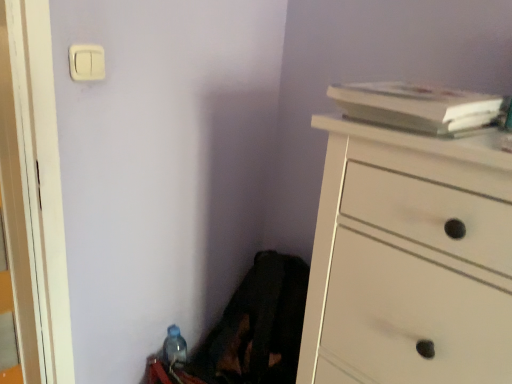
Question: From a real-world perspective, is translucent plastic bottle at lower left physically located above or below white plastic light switch at upper left?

Choices:
 (A) above
 (B) below

Answer: (B)

Question: Based on their positions, is translucent plastic bottle at lower left located to the left or right of white plastic light switch at upper left?

Choices:
 (A) left
 (B) right

Answer: (B)

Question: Which object is positioned farthest from the translucent plastic bottle at lower left?

Choices:
 (A) white wood chest of drawers at right
 (B) white plastic light switch at upper left
 (C) white matte book at upper right

Answer: (C)

Question: Based on their relative distances, which object is nearer to the translucent plastic bottle at lower left?

Choices:
 (A) white wood chest of drawers at right
 (B) white matte book at upper right
 (C) white plastic light switch at upper left

Answer: (A)